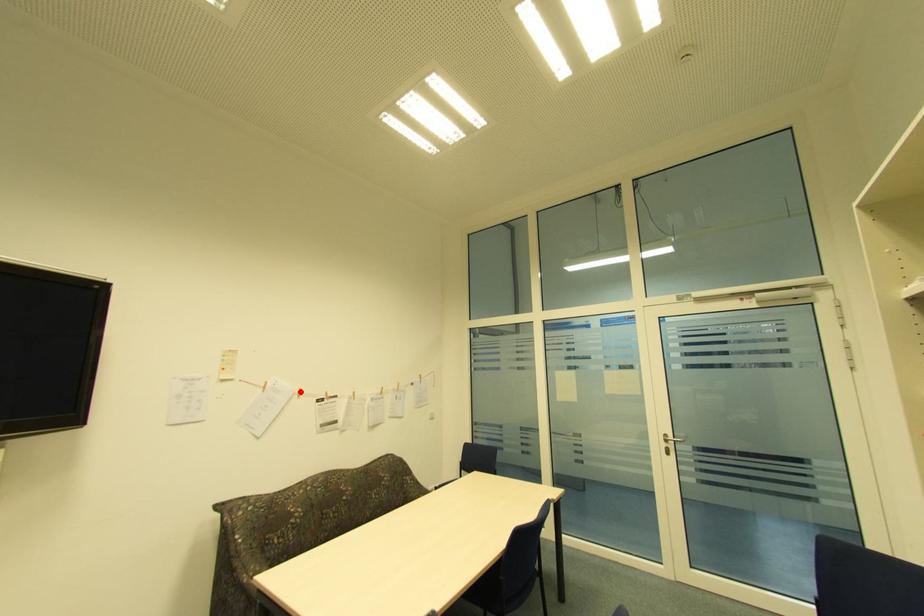
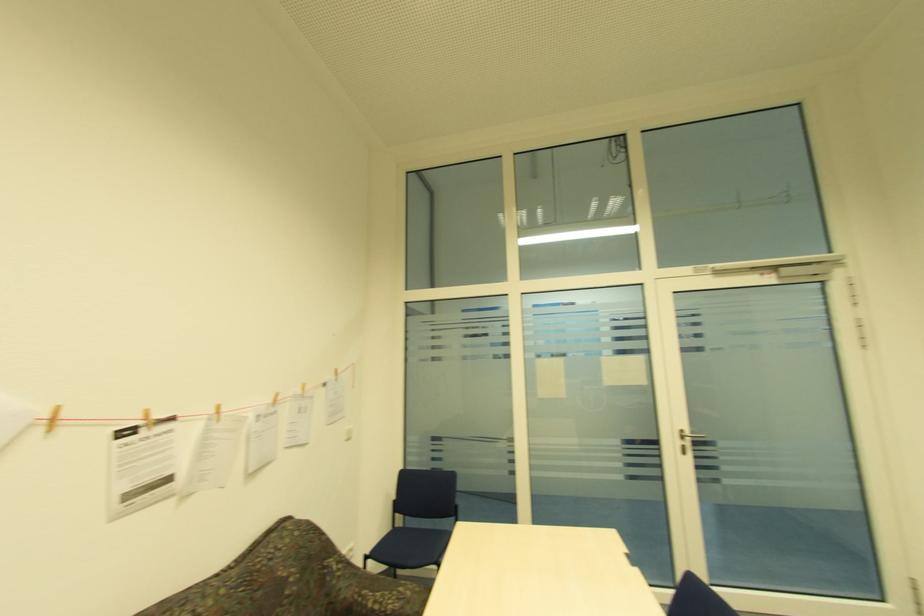
Find the pixel in the second image that matches the highlighted location in the first image.

(49, 416)